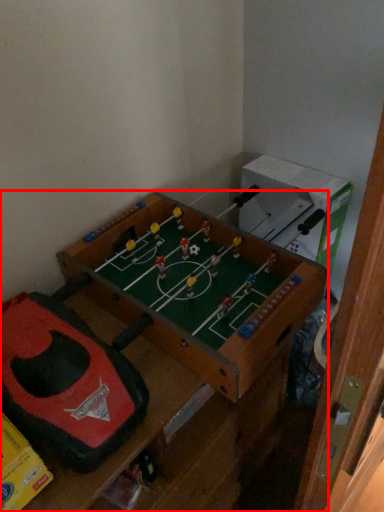
Question: Observing the image, what is the correct spatial positioning of furniture (annotated by the red box) in reference to toy?

Choices:
 (A) left
 (B) right

Answer: (B)